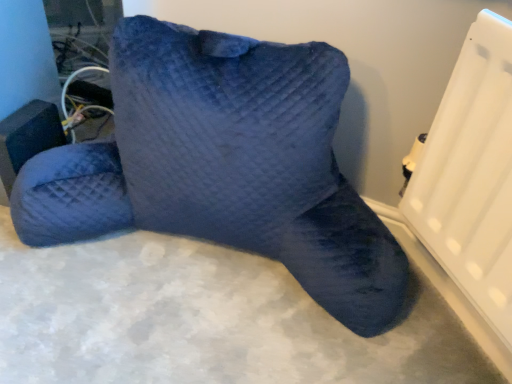
Looking at this image, measure the distance between point (13, 134) and camera.

A distance of 35.04 inches exists between point (13, 134) and camera.

This screenshot has width=512, height=384. I want to click on matte black speaker at lower left, so click(x=27, y=137).

What do you see at coordinates (27, 137) in the screenshot? The height and width of the screenshot is (384, 512). I see `matte black speaker at lower left` at bounding box center [27, 137].

What do you see at coordinates (224, 165) in the screenshot? I see `velvet blue pillow at center` at bounding box center [224, 165].

This screenshot has width=512, height=384. Find the location of `velvet blue pillow at center`. velvet blue pillow at center is located at coordinates (224, 165).

Find the location of a particular element. matte black speaker at lower left is located at coordinates (27, 137).

From the picture: Is velvet blue pillow at center to the right of matte black speaker at lower left from the viewer's perspective?

Yes, velvet blue pillow at center is to the right of matte black speaker at lower left.

Relative to matte black speaker at lower left, is velvet blue pillow at center in front or behind?

Visually, velvet blue pillow at center is located in front of matte black speaker at lower left.

Between point (151, 211) and point (12, 114), which one is positioned in front?

The point (151, 211) is closer to the camera.

From the image's perspective, is velvet blue pillow at center above or below matte black speaker at lower left?

velvet blue pillow at center is situated higher than matte black speaker at lower left in the image.

From a real-world perspective, which is physically below, velvet blue pillow at center or matte black speaker at lower left?

From a 3D spatial view, matte black speaker at lower left is below.

Which of these two, velvet blue pillow at center or matte black speaker at lower left, is thinner?

With smaller width is matte black speaker at lower left.

From their relative heights in the image, would you say velvet blue pillow at center is taller or shorter than matte black speaker at lower left?

In the image, velvet blue pillow at center appears to be taller than matte black speaker at lower left.

In terms of size, does velvet blue pillow at center appear bigger or smaller than matte black speaker at lower left?

Clearly, velvet blue pillow at center is larger in size than matte black speaker at lower left.

Is matte black speaker at lower left surrounded by velvet blue pillow at center?

Yes, matte black speaker at lower left is a part of velvet blue pillow at center.

Is velvet blue pillow at center next to matte black speaker at lower left?

No, velvet blue pillow at center is not making contact with matte black speaker at lower left.

In the scene shown: Is velvet blue pillow at center looking in the opposite direction of matte black speaker at lower left?

No, velvet blue pillow at center's orientation is not away from matte black speaker at lower left.

The image size is (512, 384). I want to click on furniture in front of the matte black speaker at lower left, so [224, 165].

Between matte black speaker at lower left and velvet blue pillow at center, which one appears on the right side from the viewer's perspective?

velvet blue pillow at center is more to the right.

Is the position of matte black speaker at lower left more distant than that of velvet blue pillow at center?

Yes, matte black speaker at lower left is further from the camera.

Does point (20, 109) come behind point (163, 102)?

That is True.

From the image's perspective, would you say matte black speaker at lower left is positioned over velvet blue pillow at center?

No, from the image's perspective, matte black speaker at lower left is not over velvet blue pillow at center.

From a real-world perspective, relative to velvet blue pillow at center, is matte black speaker at lower left vertically above or below?

From a real-world perspective, matte black speaker at lower left is physically below velvet blue pillow at center.

Which object is thinner, matte black speaker at lower left or velvet blue pillow at center?

Thinner between the two is matte black speaker at lower left.

Does matte black speaker at lower left have a lesser height compared to velvet blue pillow at center?

Yes, matte black speaker at lower left is shorter than velvet blue pillow at center.

Can you confirm if matte black speaker at lower left is bigger than velvet blue pillow at center?

No, matte black speaker at lower left is not bigger than velvet blue pillow at center.

Choose the correct answer: Is matte black speaker at lower left inside velvet blue pillow at center or outside it?

matte black speaker at lower left can be found inside velvet blue pillow at center.

Is matte black speaker at lower left not close to velvet blue pillow at center?

Actually, matte black speaker at lower left and velvet blue pillow at center are a little close together.

Is velvet blue pillow at center at the back of matte black speaker at lower left?

Yes.

This screenshot has height=384, width=512. Find the location of `furniture above the matte black speaker at lower left (from a real-world perspective)`. furniture above the matte black speaker at lower left (from a real-world perspective) is located at coordinates (224, 165).

This screenshot has height=384, width=512. Find the location of `speaker that appears below the velvet blue pillow at center (from the image's perspective)`. speaker that appears below the velvet blue pillow at center (from the image's perspective) is located at coordinates (27, 137).

At what (x,y) coordinates should I click in order to perform the action: click on furniture in front of the matte black speaker at lower left. Please return your answer as a coordinate pair (x, y). The height and width of the screenshot is (384, 512). Looking at the image, I should click on (224, 165).